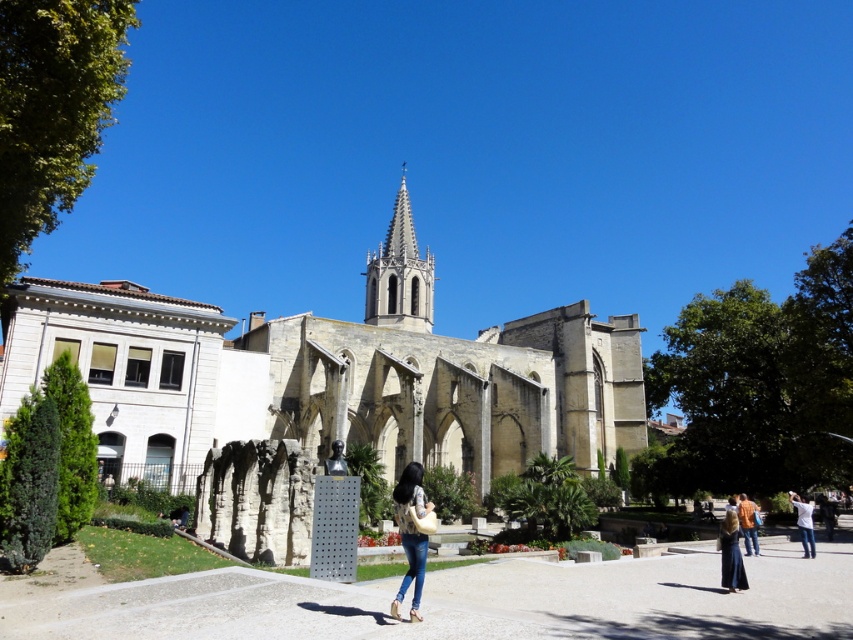
Question: Which of the following is the farthest from the observer?

Choices:
 (A) (404, 531)
 (B) (64, 298)
 (C) (728, 512)

Answer: (B)

Question: Where is yellowish stone church at center located in relation to dark blue dress at lower right in the image?

Choices:
 (A) above
 (B) below

Answer: (A)

Question: Which point is closer to the camera taking this photo?

Choices:
 (A) (735, 556)
 (B) (811, 506)
 (C) (416, 300)
 (D) (740, 509)

Answer: (A)

Question: Considering the relative positions of smooth stone spire at center and white cotton shirt at lower right in the image provided, where is smooth stone spire at center located with respect to white cotton shirt at lower right?

Choices:
 (A) left
 (B) right

Answer: (A)

Question: Which point is farther from the camera taking this photo?

Choices:
 (A) (403, 268)
 (B) (334, 468)
 (C) (404, 580)
 (D) (746, 529)

Answer: (A)

Question: In this image, where is yellowish stone church at center located relative to denim jeans at center?

Choices:
 (A) below
 (B) above

Answer: (B)